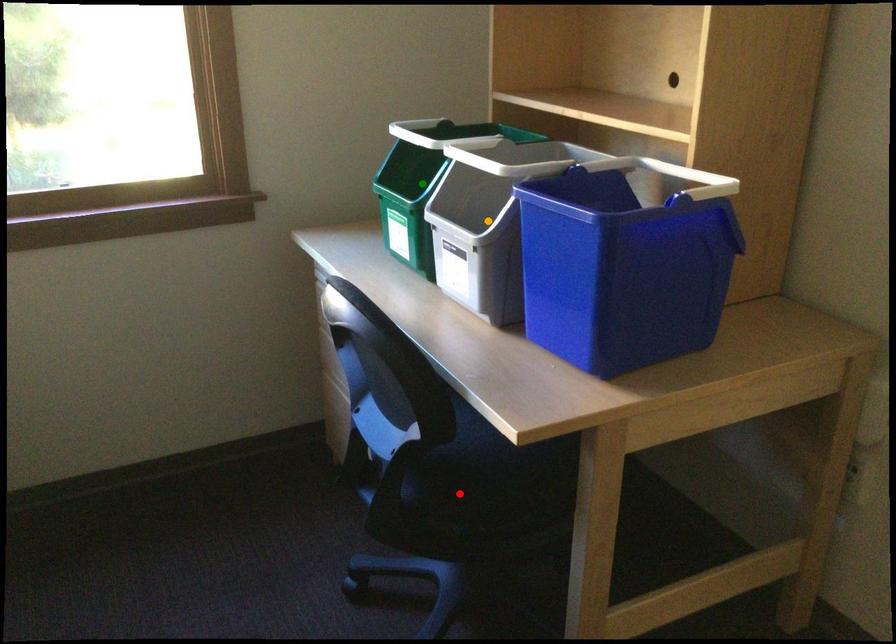
Order these from nearest to farthest:
orange point
green point
red point

red point → green point → orange point